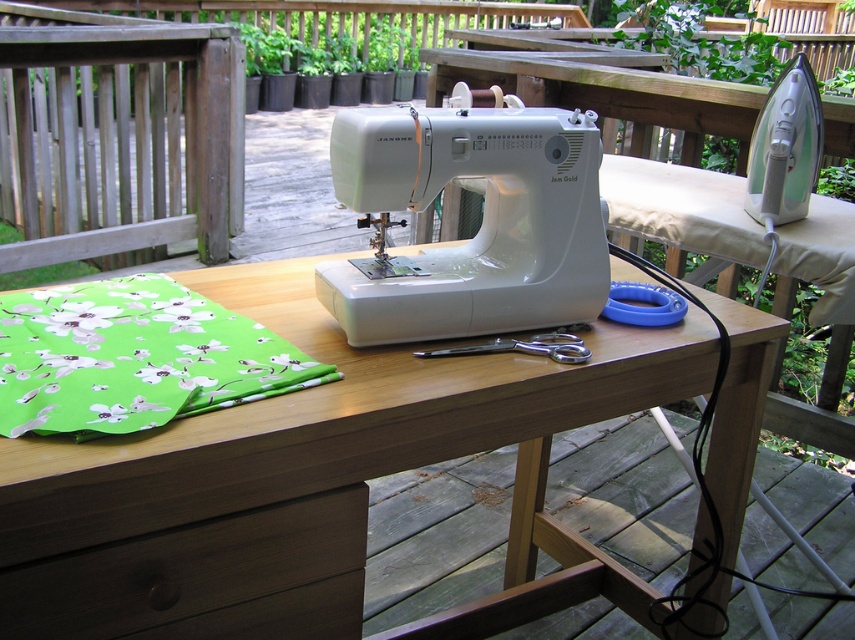
You are setting up a sewing project and need to place a large fabric roll that is 2 feet wide. Given the wooden table at center and the dark brown wood drawer at lower left, which object can accommodate the fabric roll based on their widths?

The wooden table at center can accommodate the fabric roll since its width surpasses the dark brown wood drawer at lower left.

You are a tailor working on the wooden table at center and need to place the green floral fabric at lower left. Considering the height difference between the two, will the fabric be stable on the table?

The wooden table at center is much taller than the green floral fabric at lower left, so the fabric will be stable on the table since it can rest on the table surface without any issues.

You are a tailor working on the wooden table at center and need to reach the green floral fabric at lower left. Is the fabric above or below the table?

The wooden table at center is positioned under green floral fabric at lower left, so the fabric is above the table.